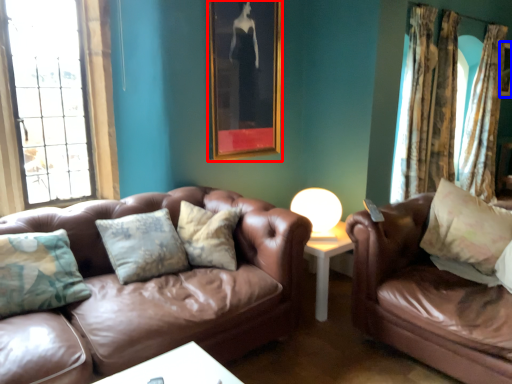
Question: Among these objects, which one is farthest to the camera, picture frame (highlighted by a red box) or picture frame (highlighted by a blue box)?

Choices:
 (A) picture frame
 (B) picture frame

Answer: (B)